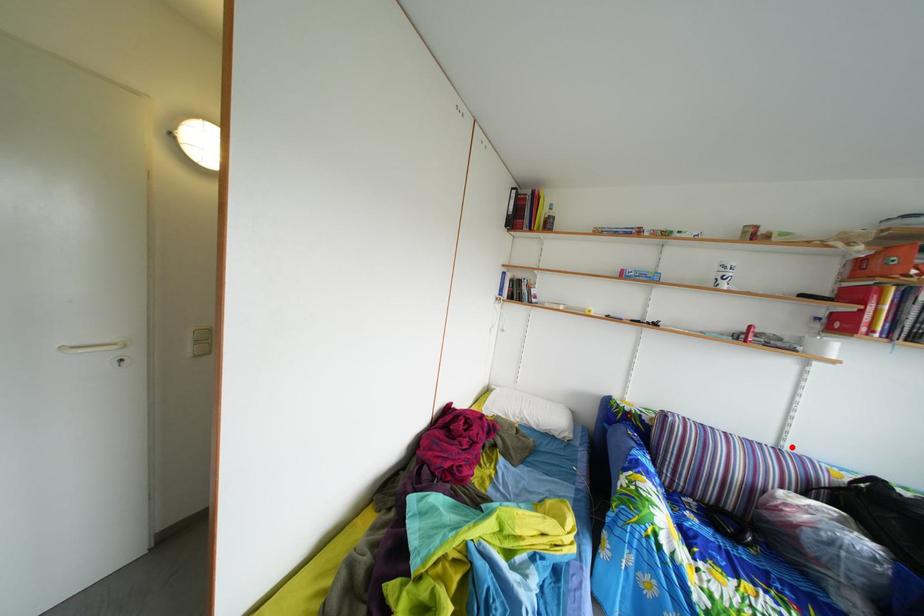
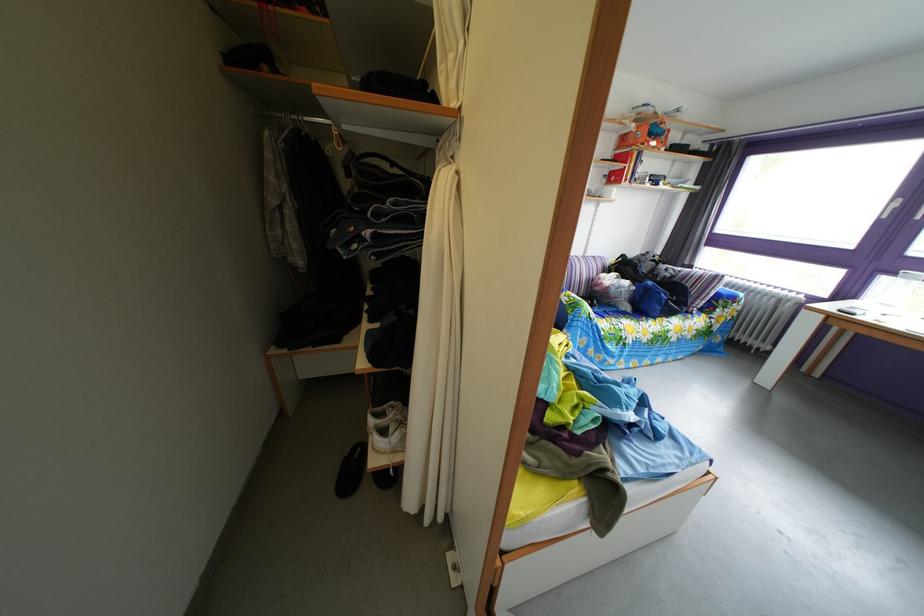
Locate, in the second image, the point that corresponds to the highlighted location in the first image.

(596, 261)